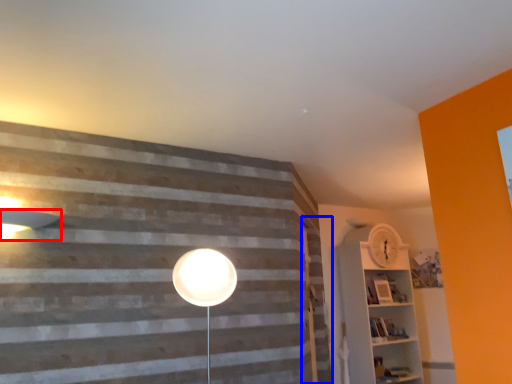
Question: Among these objects, which one is nearest to the camera, lamp (highlighted by a red box) or barn door (highlighted by a blue box)?

Choices:
 (A) lamp
 (B) barn door

Answer: (A)